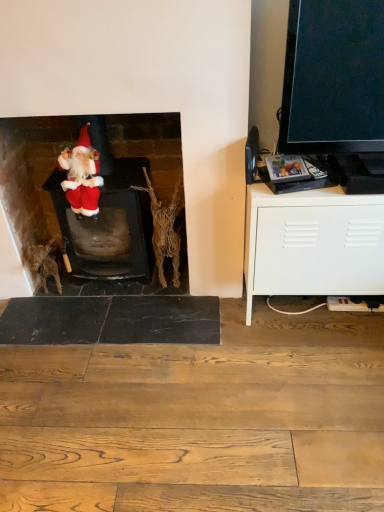
Question: Does fuzzy fabric santa at left have a lesser height compared to velvet santa at left?

Choices:
 (A) no
 (B) yes

Answer: (B)

Question: Is the surface of fuzzy fabric santa at left in direct contact with velvet santa at left?

Choices:
 (A) no
 (B) yes

Answer: (A)

Question: From the image's perspective, would you say fuzzy fabric santa at left is positioned over velvet santa at left?

Choices:
 (A) no
 (B) yes

Answer: (B)

Question: Considering the relative sizes of fuzzy fabric santa at left and velvet santa at left in the image provided, is fuzzy fabric santa at left bigger than velvet santa at left?

Choices:
 (A) no
 (B) yes

Answer: (A)

Question: From a real-world perspective, is fuzzy fabric santa at left on velvet santa at left?

Choices:
 (A) no
 (B) yes

Answer: (B)

Question: Is fuzzy fabric santa at left at the left side of velvet santa at left?

Choices:
 (A) no
 (B) yes

Answer: (B)

Question: Is fuzzy fabric santa at left in front of white matte cabinet at right?

Choices:
 (A) yes
 (B) no

Answer: (B)

Question: From a real-world perspective, is fuzzy fabric santa at left on white matte cabinet at right?

Choices:
 (A) no
 (B) yes

Answer: (B)

Question: Considering the relative sizes of fuzzy fabric santa at left and white matte cabinet at right in the image provided, is fuzzy fabric santa at left wider than white matte cabinet at right?

Choices:
 (A) no
 (B) yes

Answer: (A)

Question: Is fuzzy fabric santa at left at the right side of white matte cabinet at right?

Choices:
 (A) no
 (B) yes

Answer: (A)

Question: Considering the relative sizes of fuzzy fabric santa at left and white matte cabinet at right in the image provided, is fuzzy fabric santa at left thinner than white matte cabinet at right?

Choices:
 (A) yes
 (B) no

Answer: (A)

Question: Is fuzzy fabric santa at left looking in the opposite direction of white matte cabinet at right?

Choices:
 (A) no
 (B) yes

Answer: (A)

Question: Considering the relative sizes of velvet santa at left and fuzzy fabric santa at left in the image provided, is velvet santa at left taller than fuzzy fabric santa at left?

Choices:
 (A) no
 (B) yes

Answer: (B)